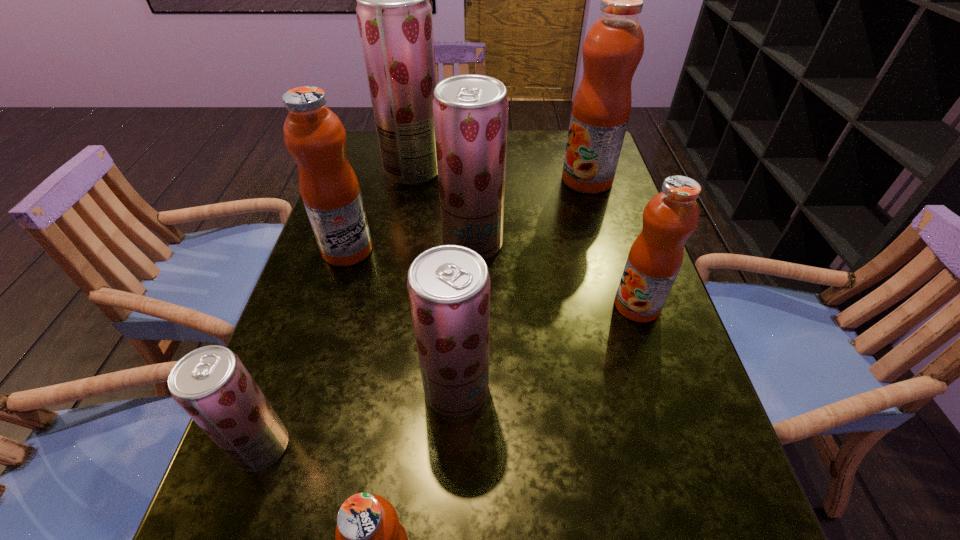
This screenshot has width=960, height=540. What are the coordinates of `free point between the leftmost strawberry fruit juice and the farthest strawberry fruit juice` in the screenshot? It's located at (338, 308).

This screenshot has width=960, height=540. In order to click on the fifth closest object to the farthest strawberry fruit juice in this screenshot , I will do `click(448, 286)`.

Point out which object is positioned as the seventh nearest to the farthest strawberry fruit juice. Please provide its 2D coordinates. Your answer should be formatted as a tuple, i.e. [(x, y)], where the tuple contains the x and y coordinates of a point satisfying the conditions above.

[(369, 539)]

Identify the location of the closest fruit juice to the second strawberry fruit juice from left to right. The width and height of the screenshot is (960, 540). (470, 111).

Select which fruit juice appears as the sixth closest to the farthest orange fruit juice. Please provide its 2D coordinates. Your answer should be formatted as a tuple, i.e. [(x, y)], where the tuple contains the x and y coordinates of a point satisfying the conditions above.

[(211, 384)]

Select which strawberry fruit juice appears as the fourth closest to the second biggest orange fruit juice. Please provide its 2D coordinates. Your answer should be formatted as a tuple, i.e. [(x, y)], where the tuple contains the x and y coordinates of a point satisfying the conditions above.

[(211, 384)]

Find the location of `the closest strawberry fruit juice relative to the second farthest strawberry fruit juice`. the closest strawberry fruit juice relative to the second farthest strawberry fruit juice is located at coordinates (394, 15).

Locate an element on the screen. The width and height of the screenshot is (960, 540). orange fruit juice that is the third closest to the second smallest orange fruit juice is located at coordinates (313, 134).

I want to click on the second closest orange fruit juice relative to the fifth farthest object, so click(x=369, y=539).

The height and width of the screenshot is (540, 960). In order to click on blank area in the image that satisfies the following two spatial constraints: 1. on the front label of the third biggest strawberry fruit juice; 2. on the right side of the leftmost orange fruit juice in this screenshot , I will do `click(304, 389)`.